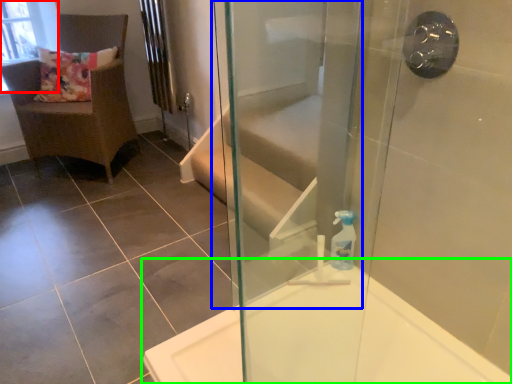
Question: Which object is positioned farthest from window screen (highlighted by a red box)? Select from screen door (highlighted by a blue box) and bathtub (highlighted by a green box).

Choices:
 (A) screen door
 (B) bathtub

Answer: (B)